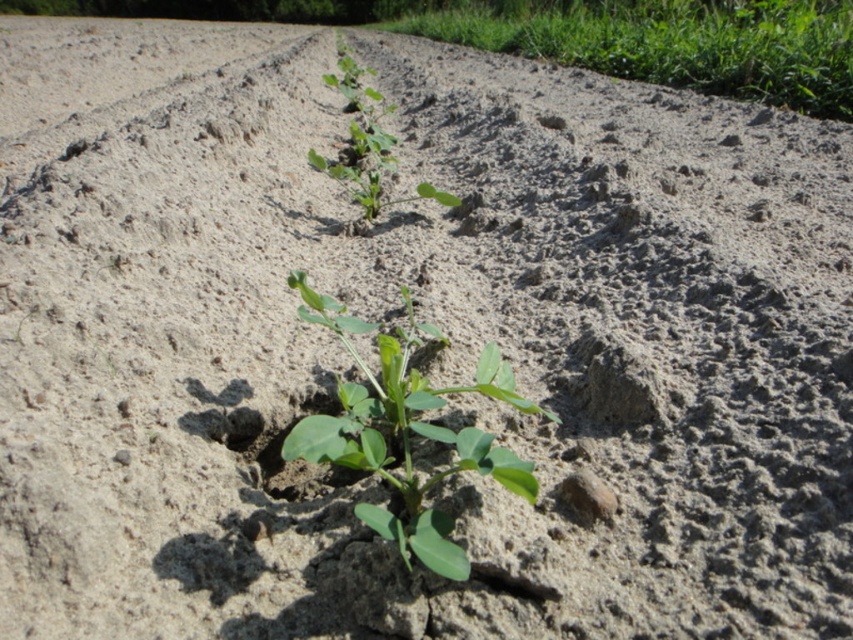
Question: Among these objects, which one is nearest to the camera?

Choices:
 (A) green leafy plant at upper right
 (B) green leafy plant at center
 (C) green matte plant at center

Answer: (C)

Question: Does green leafy plant at upper right appear over green leafy plant at center?

Choices:
 (A) no
 (B) yes

Answer: (B)

Question: Which point is closer to the camera taking this photo?

Choices:
 (A) (357, 113)
 (B) (404, 429)
 (C) (740, 83)

Answer: (B)

Question: Does green matte plant at center come behind green leafy plant at center?

Choices:
 (A) yes
 (B) no

Answer: (B)

Question: Can you confirm if green matte plant at center is positioned above green leafy plant at center?

Choices:
 (A) yes
 (B) no

Answer: (B)

Question: Among these objects, which one is nearest to the camera?

Choices:
 (A) green leafy plant at center
 (B) green matte plant at center

Answer: (B)